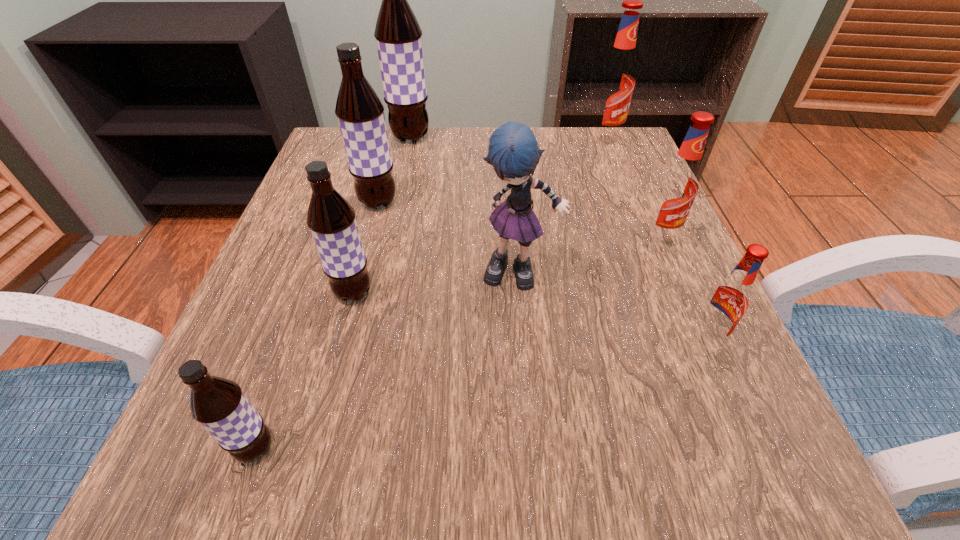
Locate an element on the screen. The height and width of the screenshot is (540, 960). free space in the image that satisfies the following two spatial constraints: 1. on the front-facing side of the fifth object from left to right; 2. on the left side of the sixth farthest root beer is located at coordinates (525, 338).